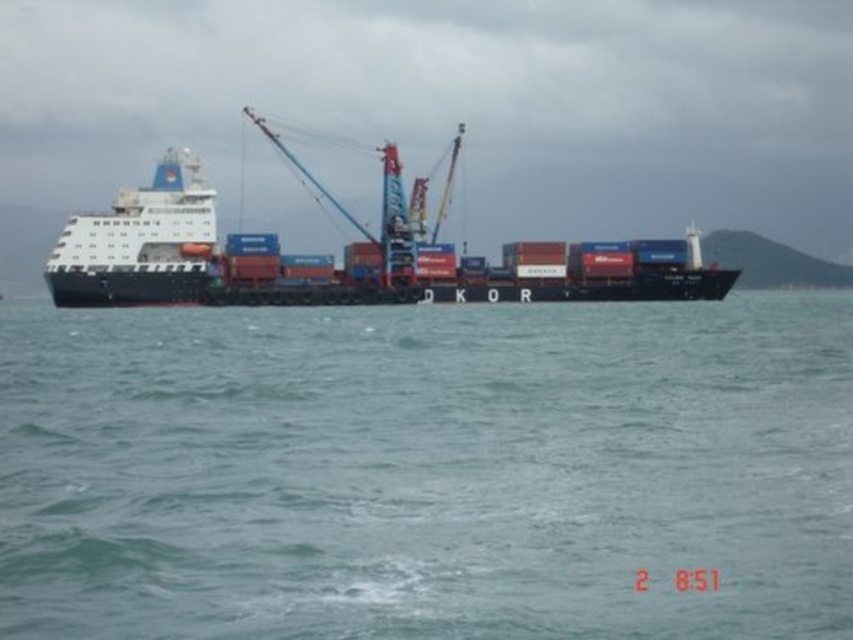
Is blue water at center wider than black matte container ship at center?

In fact, blue water at center might be narrower than black matte container ship at center.

Is blue water at center further to camera compared to black matte container ship at center?

No, blue water at center is closer to the viewer.

Is point (49, 394) positioned after point (65, 234)?

No, (49, 394) is in front of (65, 234).

At what (x,y) coordinates should I click in order to perform the action: click on blue water at center. Please return your answer as a coordinate pair (x, y). Looking at the image, I should click on (428, 470).

Does black matte container ship at center have a greater height compared to white glossy cruise ship at upper left?

Indeed, black matte container ship at center has a greater height compared to white glossy cruise ship at upper left.

This screenshot has height=640, width=853. I want to click on black matte container ship at center, so click(344, 268).

Does blue water at center have a lesser height compared to white glossy cruise ship at upper left?

Correct, blue water at center is not as tall as white glossy cruise ship at upper left.

Between blue water at center and white glossy cruise ship at upper left, which one has less height?

Standing shorter between the two is blue water at center.

Between point (595, 589) and point (97, 241), which one is positioned in front?

Positioned in front is point (595, 589).

Identify the location of blue water at center. (428, 470).